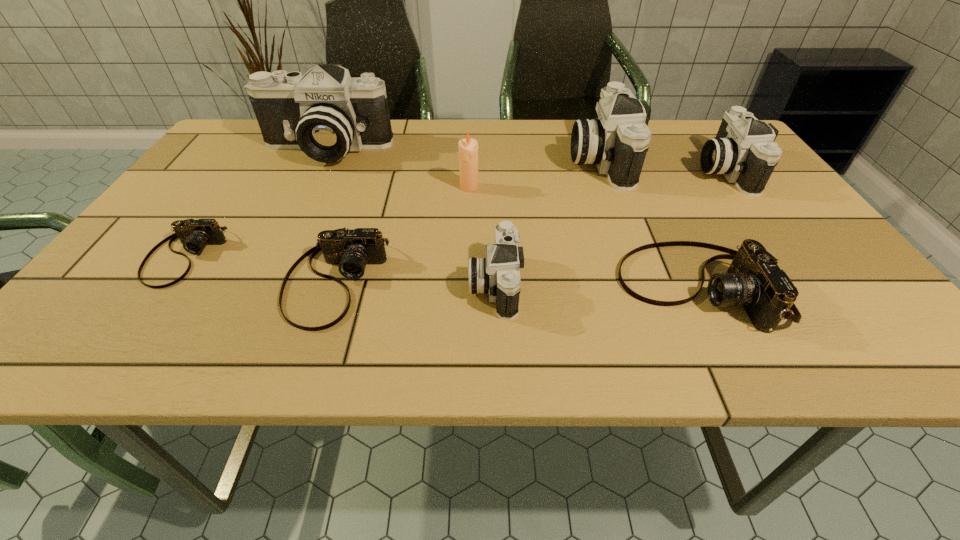
At what (x,y) coordinates should I click in order to perform the action: click on the biggest brown camera. Please return your answer as a coordinate pair (x, y). The width and height of the screenshot is (960, 540). Looking at the image, I should click on (753, 280).

Where is `the seventh tallest object`? the seventh tallest object is located at coordinates (352, 249).

Find the location of `the sixth tallest camera`. the sixth tallest camera is located at coordinates coord(352,249).

Locate an element on the screen. The height and width of the screenshot is (540, 960). the shortest camera is located at coordinates (195, 235).

Locate an element on the screen. This screenshot has width=960, height=540. the shortest object is located at coordinates coord(195,235).

The width and height of the screenshot is (960, 540). Find the location of `free space located on the front of the tallest object`. free space located on the front of the tallest object is located at coordinates (285, 232).

The width and height of the screenshot is (960, 540). What are the coordinates of `vacant space located on the front of the sixth shortest camera` in the screenshot? It's located at (631, 242).

Find the location of a particular element. vacant area situated on the left of the fifth shortest camera is located at coordinates (606, 170).

You are a GUI agent. You are given a task and a screenshot of the screen. Output one action in this format:
    pyautogui.click(x=<x>, y=<y>)
    Task: Click on the vacant space located on the back of the candle
    
    Given the screenshot: What is the action you would take?
    pyautogui.click(x=470, y=161)

At what (x,y) coordinates should I click in order to perform the action: click on vacant region located 0.060m on the front of the fourth shortest object. Please return your answer as a coordinate pair (x, y). The width and height of the screenshot is (960, 540). Looking at the image, I should click on (497, 348).